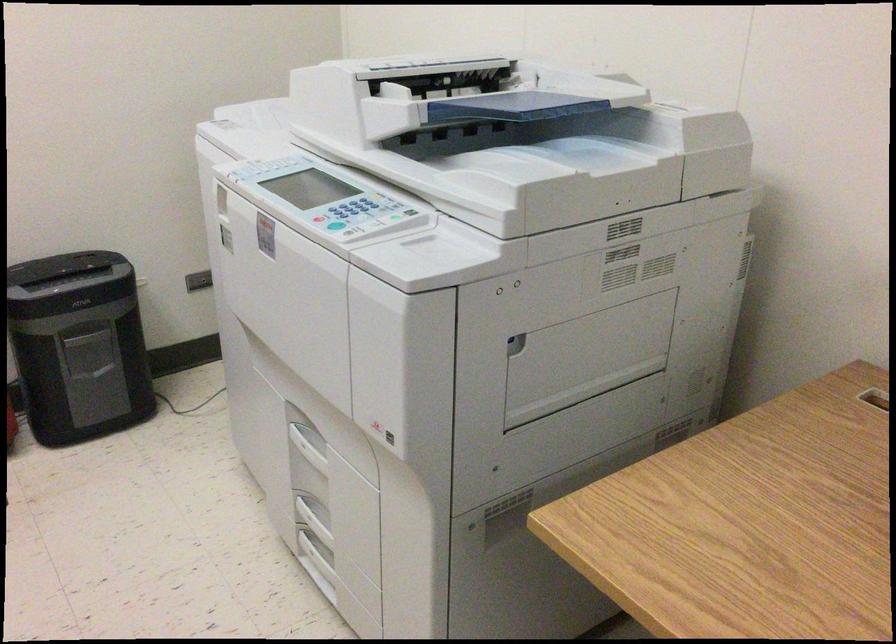
The width and height of the screenshot is (896, 644). Identify the location of printer door handle. (296, 350).